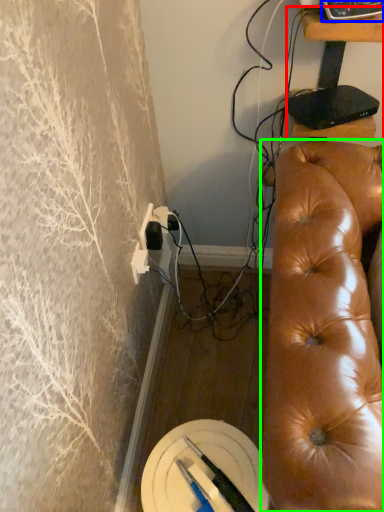
Question: Based on their relative distances, which object is farther from furniture (highlighted by a red box)? Choose from equipment (highlighted by a blue box) and studio couch (highlighted by a green box).

Choices:
 (A) equipment
 (B) studio couch

Answer: (B)